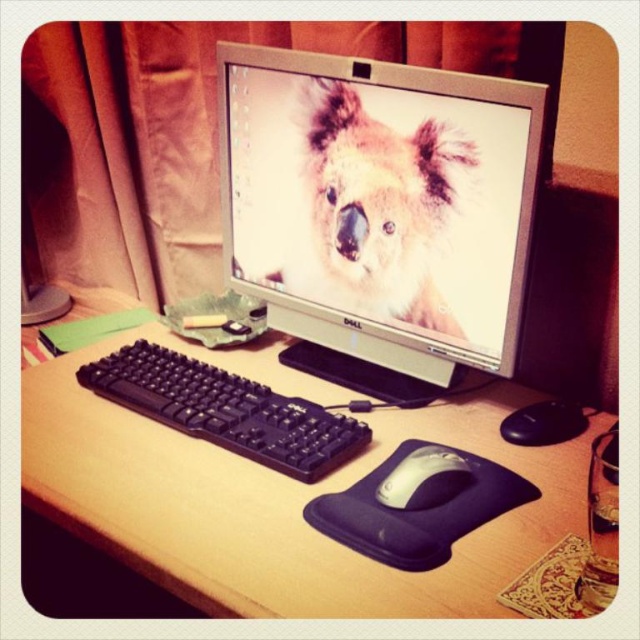
You are a delivery person who needs to place a 25 inch box on the desk without covering the satin silver monitor at center. Is there enough space in front of the monitor to place the box?

The satin silver monitor at center is 30.31 inches away from the camera, so placing a 25 inch box in front of it would leave 5.31 inches of space. This might be tight, but the box can fit as long as it is centered and not larger than 25 inches in length.

From the picture: You are setting up a new monitor on the brown wood computer desk at center. The monitor requires a minimum of 4 inches of space between the desk edge and the keyboard. Based on the current setup, will the black plastic keyboard at center have enough space?

The brown wood computer desk at center is 3.64 inches away from the black plastic keyboard at center, which is less than the required 4 inches. Therefore, the keyboard does not have enough space.

You are a person sitting at the brown wood computer desk at center. You want to reach for the black plastic keyboard at center. Is the keyboard within easy reach from your sitting position?

The brown wood computer desk at center is closer to the viewer than black plastic keyboard at center, so yes, the keyboard is within easy reach from your sitting position because it is positioned closer to you on the desk.